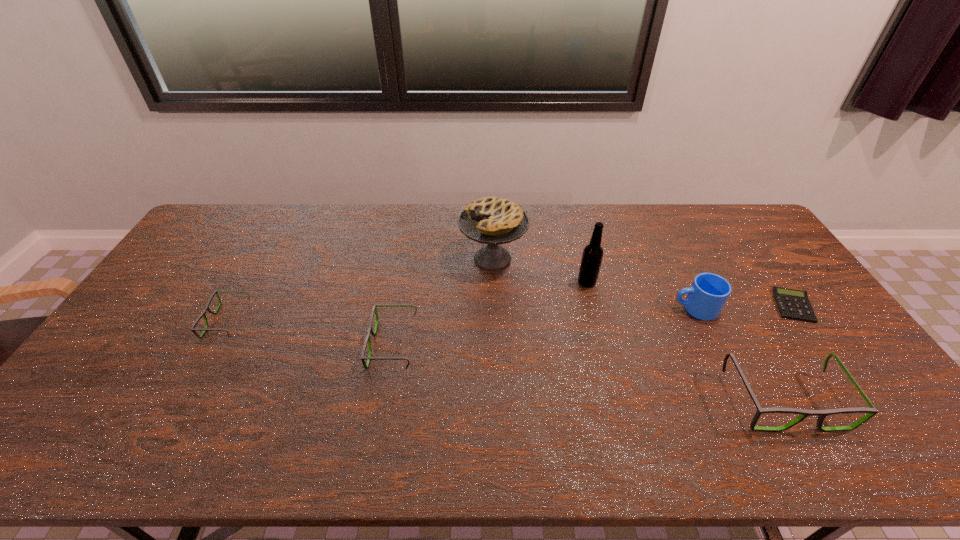
Identify the location of free space located 0.250m on the cut side of the third object from left to right. (385, 259).

Image resolution: width=960 pixels, height=540 pixels. I want to click on free space located 0.230m on the side of the mug with the handle, so click(595, 308).

Identify the location of blank space located on the side of the mug with the handle. Image resolution: width=960 pixels, height=540 pixels. (602, 308).

You are a GUI agent. You are given a task and a screenshot of the screen. Output one action in this format:
    pyautogui.click(x=<x>, y=<y>)
    Task: Click on the vacant space located 0.350m on the side of the mug with the handle
    
    Given the screenshot: What is the action you would take?
    pyautogui.click(x=556, y=308)

Where is `object located in the far edge section of the desktop`? This screenshot has width=960, height=540. object located in the far edge section of the desktop is located at coordinates (490, 220).

Locate an element on the screen. object present at the near edge is located at coordinates (871, 411).

What are the coordinates of `spectacles positioned at the right edge` in the screenshot? It's located at point(871,411).

Locate an element on the screen. calculator that is positioned at the right edge is located at coordinates (793, 304).

Where is `object that is at the near right corner`? object that is at the near right corner is located at coordinates (871, 411).

This screenshot has width=960, height=540. What are the coordinates of `blank space at the far edge` in the screenshot? It's located at (278, 229).